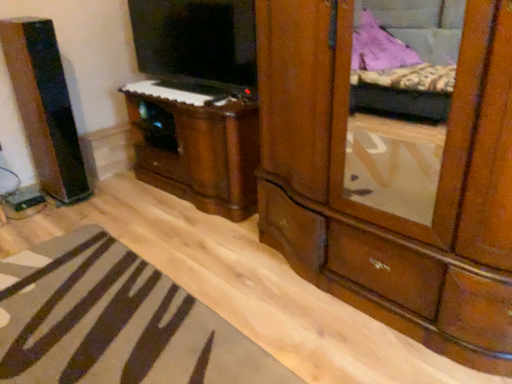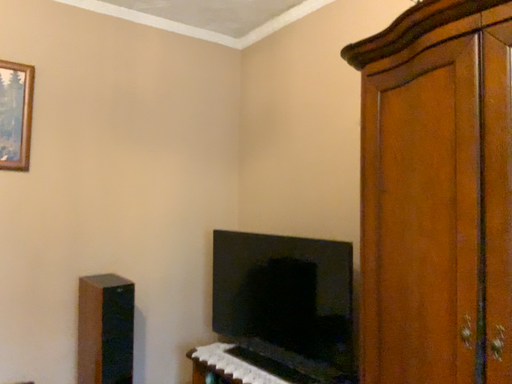
Question: Which way did the camera rotate in the video?

Choices:
 (A) rotated right
 (B) rotated left

Answer: (B)